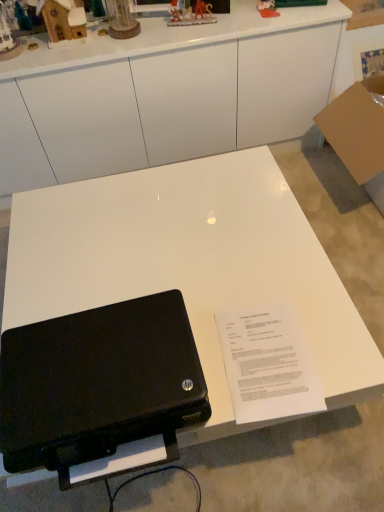
Question: Which direction should I rotate to look at metallic silver sleigh at upper center, placed as the second toy when sorted from right to left?

Choices:
 (A) right
 (B) left

Answer: (B)

Question: Should I look upward or downward to see plastic toy at upper center, which is the 5th toy in left-to-right order?

Choices:
 (A) down
 (B) up

Answer: (B)

Question: Does metallic silver sleigh at upper center, the 4th toy in the left-to-right sequence, have a greater width compared to white paper at center?

Choices:
 (A) no
 (B) yes

Answer: (A)

Question: From a real-world perspective, is metallic silver sleigh at upper center, placed as the second toy when sorted from right to left, on top of white paper at center?

Choices:
 (A) no
 (B) yes

Answer: (B)

Question: Is metallic silver sleigh at upper center, the 4th toy in the left-to-right sequence, positioned beyond the bounds of white paper at center?

Choices:
 (A) no
 (B) yes

Answer: (B)

Question: Can you confirm if metallic silver sleigh at upper center, placed as the second toy when sorted from right to left, is shorter than white paper at center?

Choices:
 (A) yes
 (B) no

Answer: (B)

Question: From a real-world perspective, does metallic silver sleigh at upper center, the 4th toy in the left-to-right sequence, sit lower than white paper at center?

Choices:
 (A) no
 (B) yes

Answer: (A)

Question: Would you say metallic silver sleigh at upper center, the 4th toy in the left-to-right sequence, contains white paper at center?

Choices:
 (A) yes
 (B) no

Answer: (B)

Question: From the image's perspective, does white glossy desk at center appear lower than wooden house at upper left, the 5th toy in the right-to-left sequence?

Choices:
 (A) yes
 (B) no

Answer: (A)

Question: Is white glossy desk at center not within wooden house at upper left, which ranks as the first toy in left-to-right order?

Choices:
 (A) no
 (B) yes

Answer: (B)

Question: Is white glossy desk at center not close to wooden house at upper left, which ranks as the first toy in left-to-right order?

Choices:
 (A) yes
 (B) no

Answer: (B)

Question: Does white glossy desk at center have a smaller size compared to wooden house at upper left, the 5th toy in the right-to-left sequence?

Choices:
 (A) no
 (B) yes

Answer: (A)

Question: Considering the relative sizes of white glossy desk at center and wooden house at upper left, the 5th toy in the right-to-left sequence, in the image provided, is white glossy desk at center shorter than wooden house at upper left, the 5th toy in the right-to-left sequence,?

Choices:
 (A) no
 (B) yes

Answer: (A)

Question: Could wooden house at upper left, which ranks as the first toy in left-to-right order, be considered to be inside white glossy desk at center?

Choices:
 (A) no
 (B) yes

Answer: (A)

Question: Does black matte laptop at lower left have a lesser height compared to plastic toy at upper center, which is the 5th toy in left-to-right order?

Choices:
 (A) no
 (B) yes

Answer: (A)